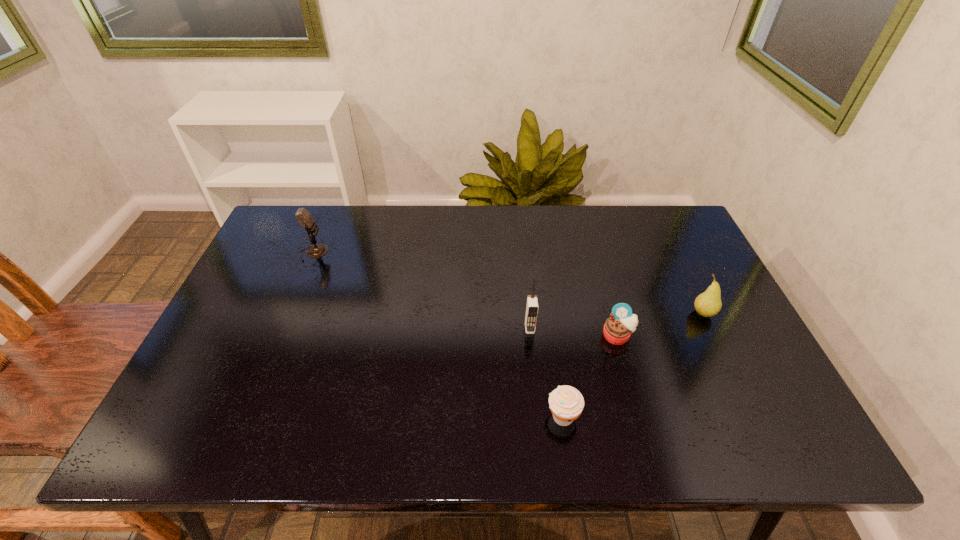
The image size is (960, 540). What are the coordinates of `cellular telephone` in the screenshot? It's located at tap(531, 313).

Identify the location of microphone. (304, 218).

The width and height of the screenshot is (960, 540). I want to click on the leftmost object, so click(x=304, y=218).

The height and width of the screenshot is (540, 960). What are the coordinates of `the third shortest object` in the screenshot? It's located at (707, 304).

The image size is (960, 540). What are the coordinates of `the rightmost object` in the screenshot? It's located at (707, 304).

Locate an element on the screen. The height and width of the screenshot is (540, 960). the farther muffin is located at coordinates (618, 328).

The image size is (960, 540). Find the location of `the fourth object from left to right`. the fourth object from left to right is located at coordinates (618, 328).

You are a GUI agent. You are given a task and a screenshot of the screen. Output one action in this format:
    pyautogui.click(x=<x>, y=<y>)
    Task: Click on the left muffin
    Image resolution: width=960 pixels, height=540 pixels.
    Given the screenshot: What is the action you would take?
    pyautogui.click(x=566, y=403)

The image size is (960, 540). Identify the location of the nearer muffin. (566, 403).

Locate an element on the screen. vacant space located 0.260m on the front-facing side of the cellular telephone is located at coordinates (540, 430).